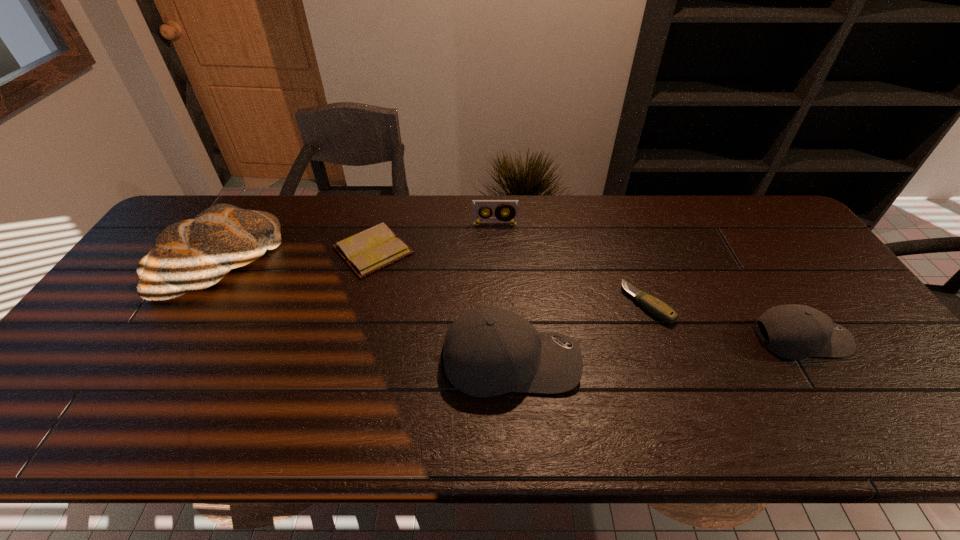
Where is `free space for a new baseball cap on the left`? The height and width of the screenshot is (540, 960). free space for a new baseball cap on the left is located at coordinates (193, 386).